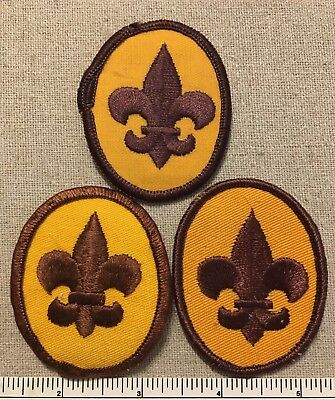
The image size is (335, 400). I want to click on fabric, so click(279, 66).